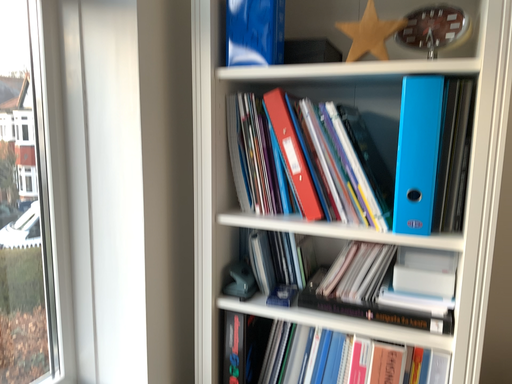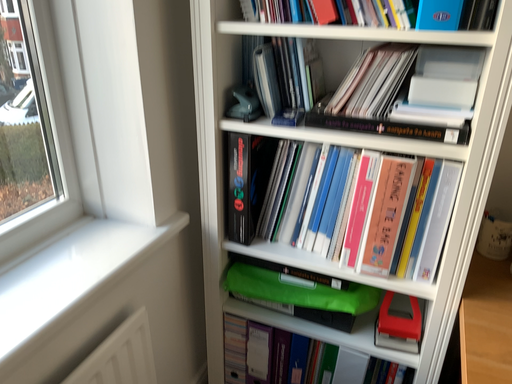
Question: How did the camera likely rotate when shooting the video?

Choices:
 (A) rotated downward
 (B) rotated upward

Answer: (A)